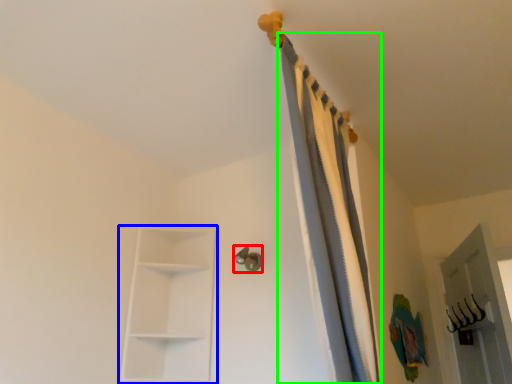
Question: Which is nearer to the door handle (highlighted by a red box)? shelf (highlighted by a blue box) or curtain (highlighted by a green box).

Choices:
 (A) shelf
 (B) curtain

Answer: (A)